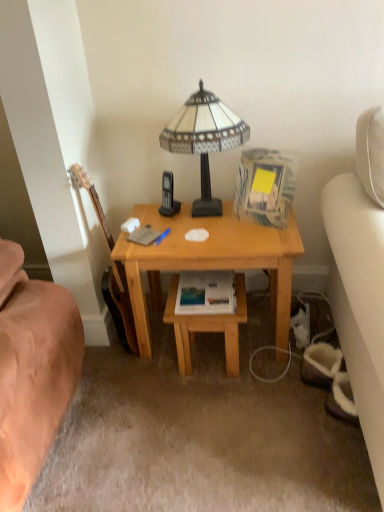
The width and height of the screenshot is (384, 512). Identify the location of vacant space in front of wooden acoustic guitar at left. (126, 378).